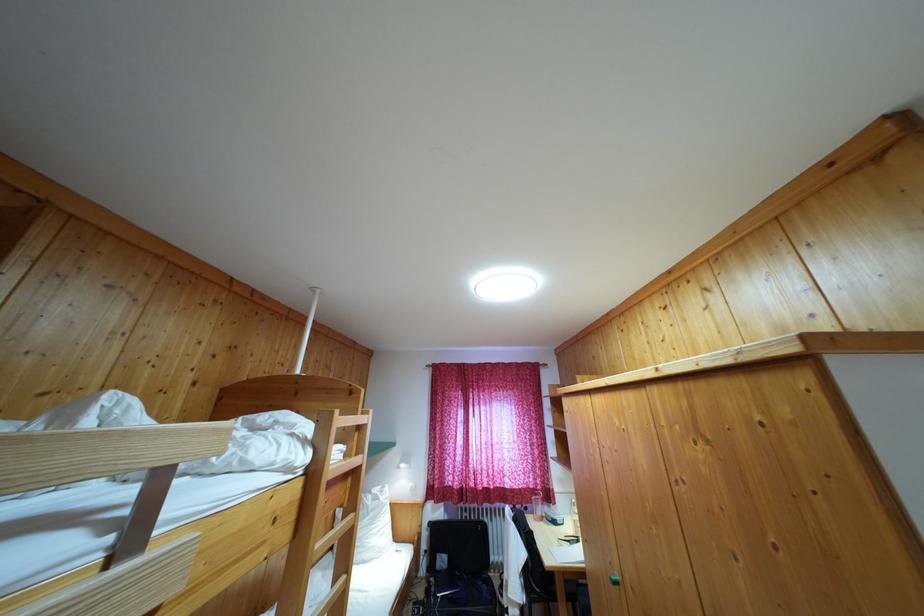
Locate an element on the screen. black chair sitting surface is located at coordinates (556, 583).